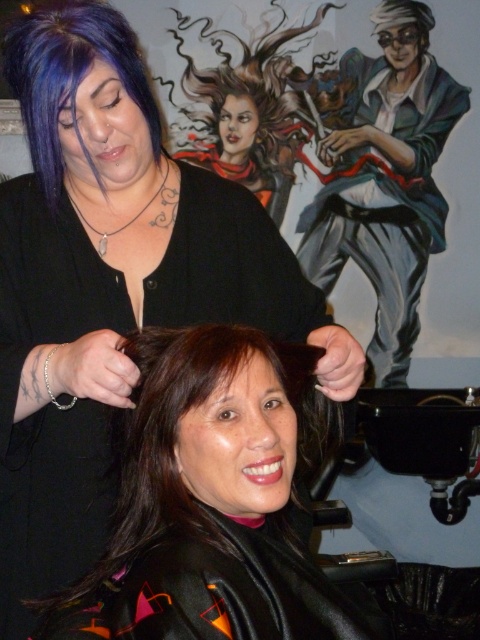
Question: Can you confirm if brown smooth hair at center is positioned to the left of shiny blue jacket at upper right?

Choices:
 (A) yes
 (B) no

Answer: (A)

Question: Which object is farther from the camera taking this photo?

Choices:
 (A) purple matte hair at upper left
 (B) brown smooth hair at center
 (C) shiny blue jacket at upper right

Answer: (C)

Question: Which point appears farthest from the camera in this image?

Choices:
 (A) (427, 145)
 (B) (214, 534)

Answer: (A)

Question: Is shiny blue jacket at upper right positioned in front of purple matte hair at upper left?

Choices:
 (A) yes
 (B) no

Answer: (B)

Question: Can you confirm if brown smooth hair at center is wider than shiny blue jacket at upper right?

Choices:
 (A) yes
 (B) no

Answer: (B)

Question: Estimate the real-world distances between objects in this image. Which object is closer to the brown smooth hair at center?

Choices:
 (A) shiny blue jacket at upper right
 (B) purple matte hair at upper left

Answer: (B)